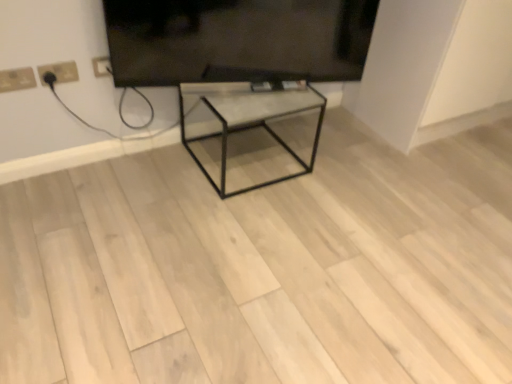
In order to face black glossy tv at upper center, should I rotate leftwards or rightwards?

Rotate left and turn 1.485 degrees.

Where is `white plastic socket at upper left, the first electric outlet in the right-to-left sequence`? white plastic socket at upper left, the first electric outlet in the right-to-left sequence is located at coordinates (59, 72).

Measure the distance between metallic glass table at center and camera.

1.77 meters.

At what (x,y) coordinates should I click in order to perform the action: click on black glossy tv at upper center. Please return your answer as a coordinate pair (x, y). The height and width of the screenshot is (384, 512). Looking at the image, I should click on (237, 40).

Choose the correct answer: Is white plastic electric outlet at upper left, which appears as the second electric outlet when viewed from the right, inside white plastic socket at upper left, the first electric outlet in the right-to-left sequence, or outside it?

white plastic electric outlet at upper left, which appears as the second electric outlet when viewed from the right, is not inside white plastic socket at upper left, the first electric outlet in the right-to-left sequence, it's outside.

How much distance is there between white plastic electric outlet at upper left, which appears as the 1th electric outlet when viewed from the left, and white plastic socket at upper left, the first electric outlet in the right-to-left sequence?

They are 3.77 inches apart.

Which is more to the left, white plastic electric outlet at upper left, which appears as the 1th electric outlet when viewed from the left, or white plastic socket at upper left, the first electric outlet in the right-to-left sequence?

Positioned to the left is white plastic electric outlet at upper left, which appears as the 1th electric outlet when viewed from the left.

Could you tell me if black glossy tv at upper center is turned towards white plastic electric outlet at upper left, which appears as the second electric outlet when viewed from the right?

No.

How different are the orientations of black glossy tv at upper center and white plastic electric outlet at upper left, which appears as the 1th electric outlet when viewed from the left, in degrees?

The angle between the facing direction of black glossy tv at upper center and the facing direction of white plastic electric outlet at upper left, which appears as the 1th electric outlet when viewed from the left, is 17.8 degrees.

From a real-world perspective, which object stands above the other?

From a 3D spatial view, black glossy tv at upper center is above.

Is black glossy tv at upper center positioned far away from white plastic electric outlet at upper left, which appears as the second electric outlet when viewed from the right?

No, black glossy tv at upper center is not far from white plastic electric outlet at upper left, which appears as the second electric outlet when viewed from the right.

Measure the distance between white plastic socket at upper left, the first electric outlet in the right-to-left sequence, and white plastic electric outlet at upper left, which appears as the second electric outlet when viewed from the right.

white plastic socket at upper left, the first electric outlet in the right-to-left sequence, and white plastic electric outlet at upper left, which appears as the second electric outlet when viewed from the right, are 3.77 inches apart from each other.

Does white plastic socket at upper left, positioned as the second electric outlet in left-to-right order, have a lesser width compared to white plastic electric outlet at upper left, which appears as the 1th electric outlet when viewed from the left?

Incorrect, the width of white plastic socket at upper left, positioned as the second electric outlet in left-to-right order, is not less than that of white plastic electric outlet at upper left, which appears as the 1th electric outlet when viewed from the left.

Is white plastic socket at upper left, positioned as the second electric outlet in left-to-right order, facing away from white plastic electric outlet at upper left, which appears as the second electric outlet when viewed from the right?

No, white plastic socket at upper left, positioned as the second electric outlet in left-to-right order, is not facing away from white plastic electric outlet at upper left, which appears as the second electric outlet when viewed from the right.

Can you confirm if white plastic socket at upper left, the first electric outlet in the right-to-left sequence, is smaller than white plastic electric outlet at upper left, which appears as the second electric outlet when viewed from the right?

No, white plastic socket at upper left, the first electric outlet in the right-to-left sequence, is not smaller than white plastic electric outlet at upper left, which appears as the second electric outlet when viewed from the right.

Is white plastic socket at upper left, the first electric outlet in the right-to-left sequence, aimed at black glossy tv at upper center?

No, white plastic socket at upper left, the first electric outlet in the right-to-left sequence, is not facing towards black glossy tv at upper center.

Considering the sizes of objects white plastic socket at upper left, the first electric outlet in the right-to-left sequence, and black glossy tv at upper center in the image provided, who is thinner, white plastic socket at upper left, the first electric outlet in the right-to-left sequence, or black glossy tv at upper center?

white plastic socket at upper left, the first electric outlet in the right-to-left sequence, is thinner.

Which is correct: white plastic socket at upper left, the first electric outlet in the right-to-left sequence, is inside black glossy tv at upper center, or outside of it?

white plastic socket at upper left, the first electric outlet in the right-to-left sequence, exists outside the volume of black glossy tv at upper center.

Is white plastic socket at upper left, positioned as the second electric outlet in left-to-right order, taller or shorter than black glossy tv at upper center?

white plastic socket at upper left, positioned as the second electric outlet in left-to-right order, is shorter than black glossy tv at upper center.

Is the position of black glossy tv at upper center more distant than that of white plastic socket at upper left, the first electric outlet in the right-to-left sequence?

No, it is not.

How far apart are black glossy tv at upper center and white plastic socket at upper left, the first electric outlet in the right-to-left sequence?

black glossy tv at upper center and white plastic socket at upper left, the first electric outlet in the right-to-left sequence, are 66.98 centimeters apart from each other.

Is white plastic socket at upper left, the first electric outlet in the right-to-left sequence, at the back of black glossy tv at upper center?

That's not correct — black glossy tv at upper center is not looking away from white plastic socket at upper left, the first electric outlet in the right-to-left sequence.

Based on the photo, how many degrees apart are the facing directions of black glossy tv at upper center and white plastic socket at upper left, the first electric outlet in the right-to-left sequence?

The angle between the facing direction of black glossy tv at upper center and the facing direction of white plastic socket at upper left, the first electric outlet in the right-to-left sequence, is 17.4 degrees.

In terms of height, does metallic glass table at center look taller or shorter compared to white plastic electric outlet at upper left, which appears as the second electric outlet when viewed from the right?

Clearly, metallic glass table at center is taller compared to white plastic electric outlet at upper left, which appears as the second electric outlet when viewed from the right.

Choose the correct answer: Is metallic glass table at center inside white plastic electric outlet at upper left, which appears as the 1th electric outlet when viewed from the left, or outside it?

metallic glass table at center is not enclosed by white plastic electric outlet at upper left, which appears as the 1th electric outlet when viewed from the left.

Is point (279, 89) farther from viewer compared to point (8, 77)?

Yes, point (279, 89) is behind point (8, 77).

Can you tell me how much metallic glass table at center and white plastic electric outlet at upper left, which appears as the 1th electric outlet when viewed from the left, differ in facing direction?

The angle between the facing direction of metallic glass table at center and the facing direction of white plastic electric outlet at upper left, which appears as the 1th electric outlet when viewed from the left, is 0.0732 degrees.

Does metallic glass table at center contain white plastic socket at upper left, the first electric outlet in the right-to-left sequence?

No, white plastic socket at upper left, the first electric outlet in the right-to-left sequence, is not inside metallic glass table at center.

Measure the distance between metallic glass table at center and white plastic socket at upper left, the first electric outlet in the right-to-left sequence.

The distance of metallic glass table at center from white plastic socket at upper left, the first electric outlet in the right-to-left sequence, is 30.40 inches.

Between metallic glass table at center and white plastic socket at upper left, positioned as the second electric outlet in left-to-right order, which one has larger width?

metallic glass table at center is wider.

Does point (261, 96) lie in front of point (44, 71)?

No, (261, 96) is behind (44, 71).

Find the location of a particular element. electric outlet lying on the right of white plastic electric outlet at upper left, which appears as the second electric outlet when viewed from the right is located at coordinates (59, 72).

At what (x,y) coordinates should I click in order to perform the action: click on television in front of the white plastic electric outlet at upper left, which appears as the 1th electric outlet when viewed from the left. Please return your answer as a coordinate pair (x, y). The width and height of the screenshot is (512, 384). Looking at the image, I should click on (237, 40).

Based on their spatial positions, is black glossy tv at upper center or white plastic socket at upper left, the first electric outlet in the right-to-left sequence, closer to white plastic electric outlet at upper left, which appears as the 1th electric outlet when viewed from the left?

white plastic socket at upper left, the first electric outlet in the right-to-left sequence, is positioned closer to the anchor white plastic electric outlet at upper left, which appears as the 1th electric outlet when viewed from the left.

Consider the image. From the image, which object appears to be nearer to black glossy tv at upper center, metallic glass table at center or white plastic electric outlet at upper left, which appears as the second electric outlet when viewed from the right?

metallic glass table at center is positioned closer to the anchor black glossy tv at upper center.

Estimate the real-world distances between objects in this image. Which object is further from metallic glass table at center, white plastic socket at upper left, positioned as the second electric outlet in left-to-right order, or white plastic electric outlet at upper left, which appears as the second electric outlet when viewed from the right?

The object further to metallic glass table at center is white plastic electric outlet at upper left, which appears as the second electric outlet when viewed from the right.

When comparing their distances from white plastic socket at upper left, the first electric outlet in the right-to-left sequence, does black glossy tv at upper center or metallic glass table at center seem further?

metallic glass table at center lies further to white plastic socket at upper left, the first electric outlet in the right-to-left sequence, than the other object.

When comparing their distances from white plastic socket at upper left, the first electric outlet in the right-to-left sequence, does white plastic electric outlet at upper left, which appears as the second electric outlet when viewed from the right, or black glossy tv at upper center seem closer?

The object closer to white plastic socket at upper left, the first electric outlet in the right-to-left sequence, is white plastic electric outlet at upper left, which appears as the second electric outlet when viewed from the right.

Based on their spatial positions, is white plastic electric outlet at upper left, which appears as the 1th electric outlet when viewed from the left, or metallic glass table at center further from black glossy tv at upper center?

The object further to black glossy tv at upper center is white plastic electric outlet at upper left, which appears as the 1th electric outlet when viewed from the left.

Which object lies further to the anchor point white plastic electric outlet at upper left, which appears as the second electric outlet when viewed from the right, metallic glass table at center or white plastic socket at upper left, the first electric outlet in the right-to-left sequence?

metallic glass table at center lies further to white plastic electric outlet at upper left, which appears as the second electric outlet when viewed from the right, than the other object.

Looking at the image, which one is located further to metallic glass table at center, white plastic socket at upper left, the first electric outlet in the right-to-left sequence, or black glossy tv at upper center?

white plastic socket at upper left, the first electric outlet in the right-to-left sequence, is positioned further to the anchor metallic glass table at center.

Locate an element on the screen. This screenshot has height=384, width=512. television between white plastic socket at upper left, positioned as the second electric outlet in left-to-right order, and metallic glass table at center, in the horizontal direction is located at coordinates [x=237, y=40].

The height and width of the screenshot is (384, 512). In order to click on television between white plastic electric outlet at upper left, which appears as the 1th electric outlet when viewed from the left, and metallic glass table at center from left to right in this screenshot , I will do `click(237, 40)`.

At what (x,y) coordinates should I click in order to perform the action: click on electric outlet between white plastic electric outlet at upper left, which appears as the 1th electric outlet when viewed from the left, and metallic glass table at center. Please return your answer as a coordinate pair (x, y). Looking at the image, I should click on (59, 72).

Where is `electric outlet between white plastic electric outlet at upper left, which appears as the 1th electric outlet when viewed from the left, and black glossy tv at upper center, in the horizontal direction`? electric outlet between white plastic electric outlet at upper left, which appears as the 1th electric outlet when viewed from the left, and black glossy tv at upper center, in the horizontal direction is located at coordinates (59, 72).